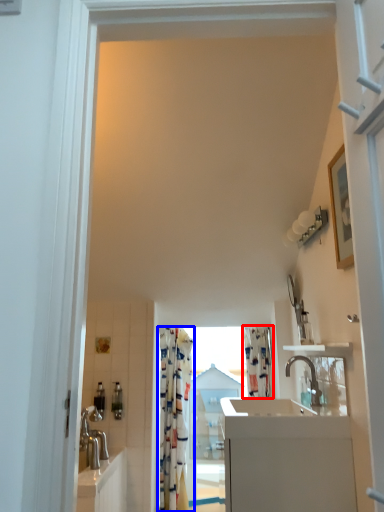
Question: Which point is further to the camera, shower curtain (highlighted by a red box) or curtain (highlighted by a blue box)?

Choices:
 (A) shower curtain
 (B) curtain

Answer: (A)